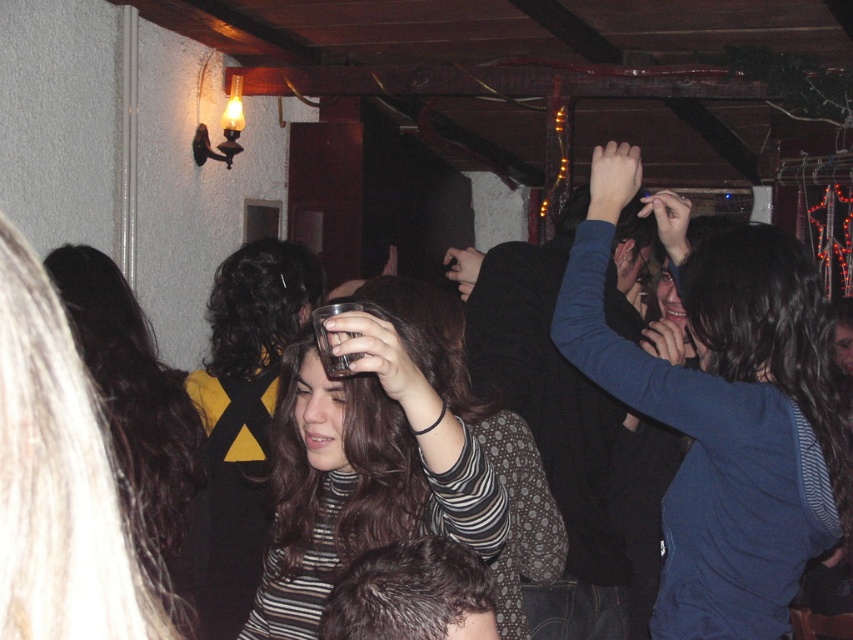
You are at a social gathering in a dimly lit room with exposed wooden beams. You see a matte plastic cup at center. Can you determine its exact coordinates in the room?

The matte plastic cup at center is located at point (370, 452).